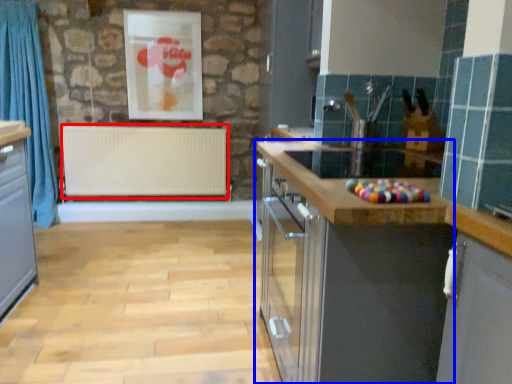
Question: Which point is further to the camera, radiator (highlighted by a red box) or cabinetry (highlighted by a blue box)?

Choices:
 (A) radiator
 (B) cabinetry

Answer: (A)